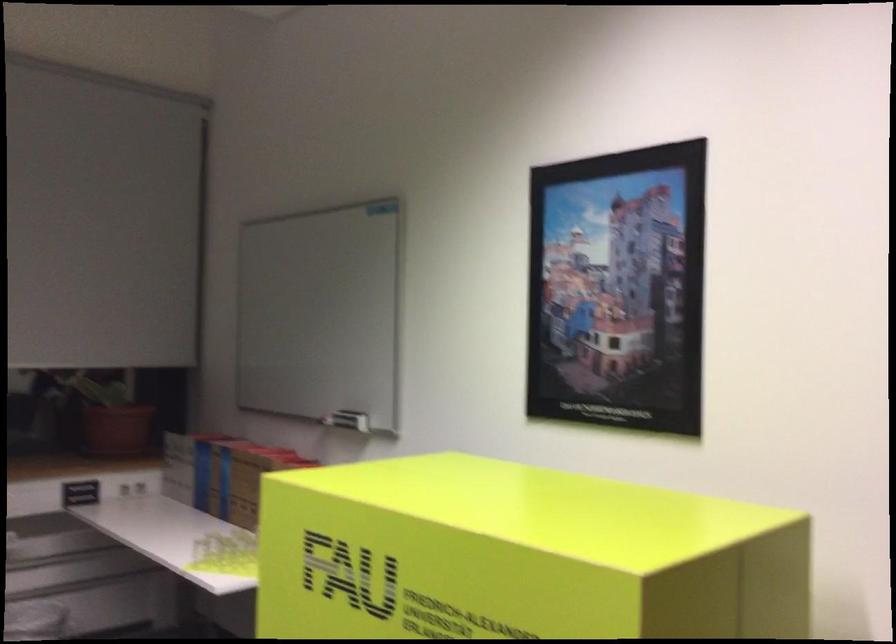
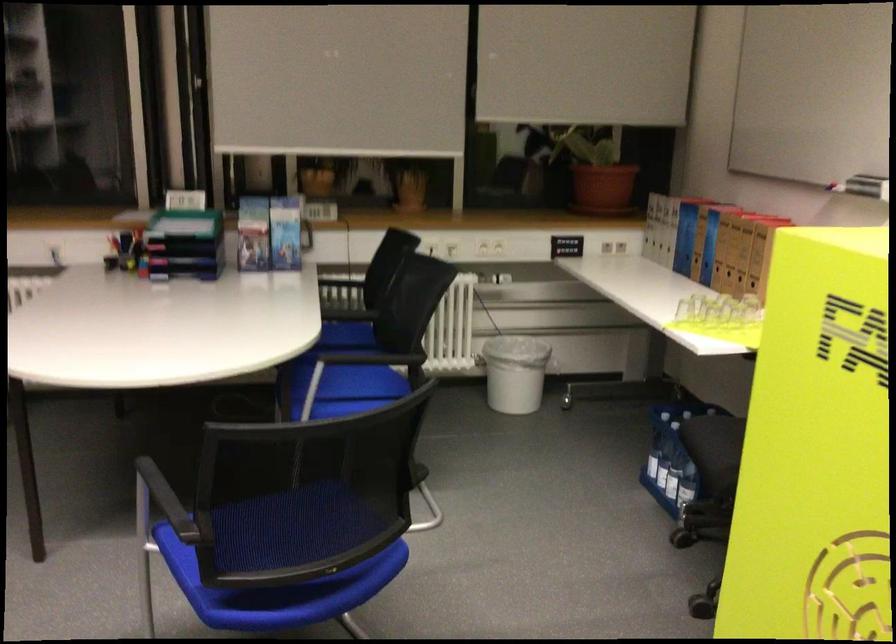
Where in the second image is the point corresponding to (x=246, y=486) from the first image?

(730, 251)